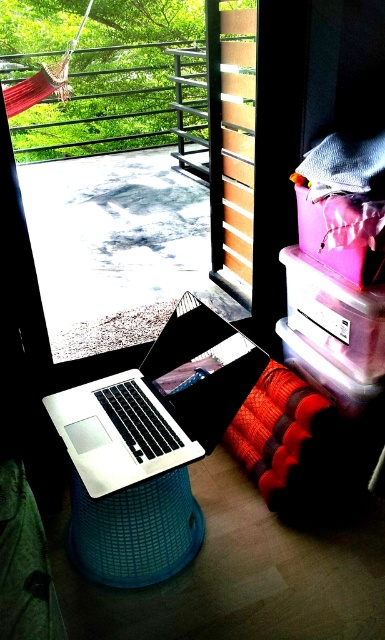
You are trying to locate the transparent glass door at upper center in the image. According to the scene description, where would you expect to find it?

The transparent glass door at upper center is located at point coordinates 0.333 in the x axis and 0.377 in the y axis.

You are standing at the origin of the coordinate system in the image. You see two points, point [125,317] and point [130,397]. Which point is closer to you?

Point [130,397] is closer to you because point [125,317] is behind it.